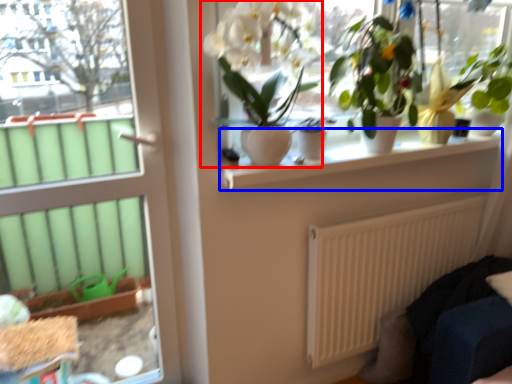
Question: Which of the following is the closest to the observer, houseplant (highlighted by a red box) or window sill (highlighted by a blue box)?

Choices:
 (A) houseplant
 (B) window sill

Answer: (A)